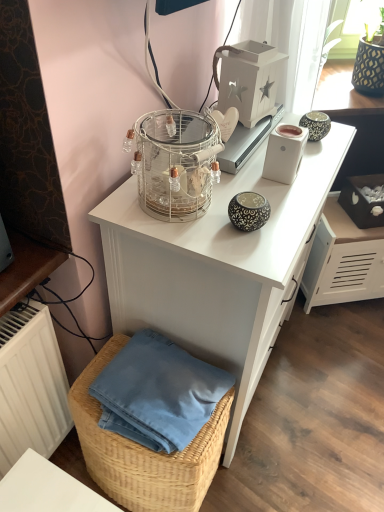
Where is `vacant space to the right of white matte rectangular device at upper center, arranged as the first appliance when ordered from the bottom`? vacant space to the right of white matte rectangular device at upper center, arranged as the first appliance when ordered from the bottom is located at coordinates (317, 166).